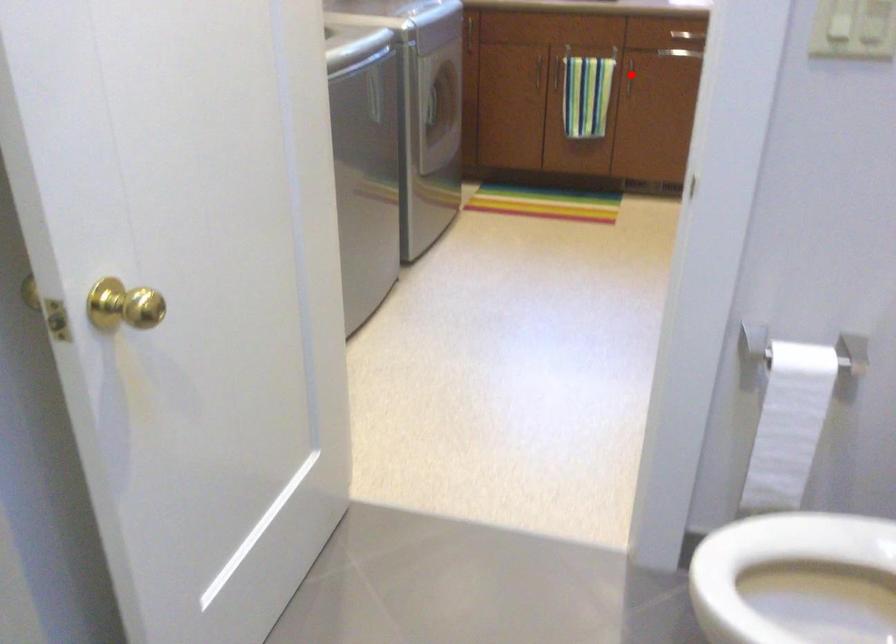
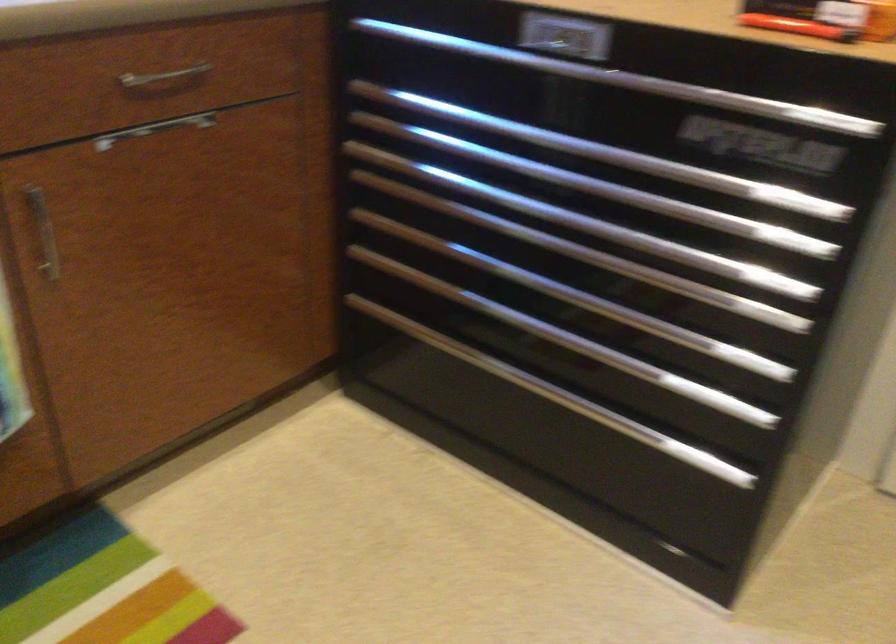
Question: I am providing you with two images of the same scene from different viewpoints. Given a red point in image1, look at the same physical point in image2. Is it:

Choices:
 (A) Closer to the viewpoint
 (B) Farther from the viewpoint

Answer: (A)